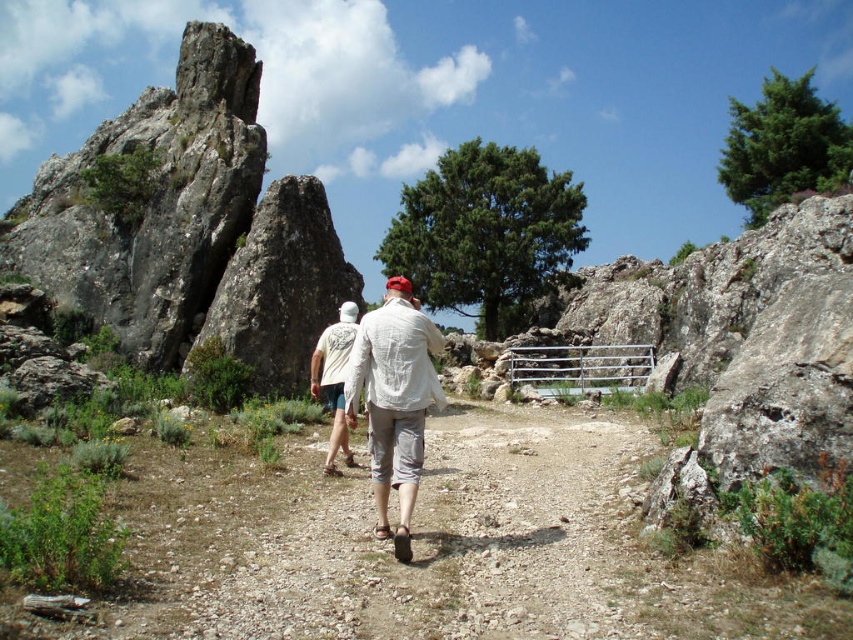
Question: Which of the following is the farthest from the observer?

Choices:
 (A) (339, 397)
 (B) (386, 488)
 (C) (149, 253)

Answer: (C)

Question: Which is nearer to the white linen shirt at center?

Choices:
 (A) white cotton shirt at center
 (B) rough gray rock formation at left

Answer: (A)

Question: Which point appears farthest from the camera in this image?

Choices:
 (A) (230, 310)
 (B) (321, 371)
 (C) (386, 467)

Answer: (A)

Question: Does rough gray rock formation at left have a lesser width compared to white linen shirt at center?

Choices:
 (A) yes
 (B) no

Answer: (B)

Question: Can you confirm if white linen shirt at center is positioned below white cotton shirt at center?

Choices:
 (A) yes
 (B) no

Answer: (A)

Question: Does rough gray rock formation at left have a greater width compared to white cotton shirt at center?

Choices:
 (A) yes
 (B) no

Answer: (A)